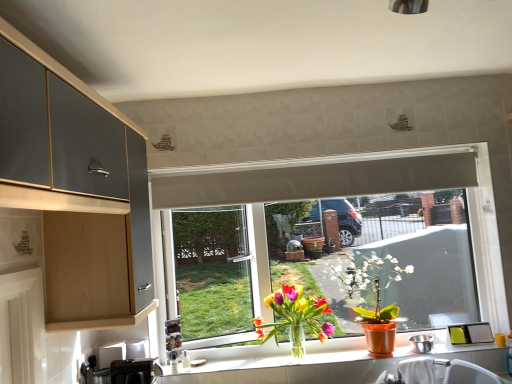
Question: Is point (304, 321) closer or farther from the camera than point (364, 264)?

Choices:
 (A) farther
 (B) closer

Answer: (B)

Question: Relative to matte orange pot at window, the first houseplant from the right, is translucent glass vase at window, the second houseplant in the right-to-left sequence, in front or behind?

Choices:
 (A) behind
 (B) front

Answer: (B)

Question: Which is nearer to the white matte exhaust hood at upper center?

Choices:
 (A) translucent glass vase at window, acting as the 1th houseplant starting from the left
 (B) black plastic toaster at lower left, which ranks as the 2th appliance in back-to-front order
 (C) metallic stainless steel bowl at window, the first appliance from the back
 (D) matte gray cabinet at upper left
 (E) translucent glass vase at lower center

Answer: (A)

Question: Estimate the real-world distances between objects in this image. Which object is closer to the translucent glass vase at window, acting as the 1th houseplant starting from the left?

Choices:
 (A) matte orange pot at window, the second houseplant positioned from the left
 (B) translucent glass vase at lower center
 (C) metallic stainless steel bowl at window, which appears as the second appliance when viewed from the left
 (D) black plastic toaster at lower left, the second appliance in the right-to-left sequence
 (E) matte gray cabinet at upper left

Answer: (B)